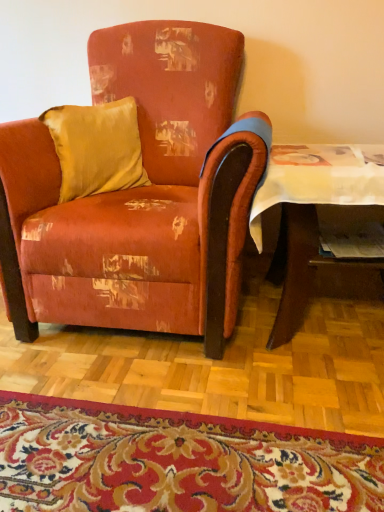
Locate an element on the screen. The height and width of the screenshot is (512, 384). vacant space underneath wooden table at lower right (from a real-world perspective) is located at coordinates (340, 334).